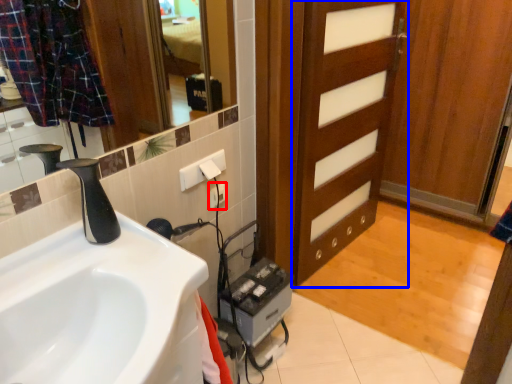
Question: Which object is closer to the camera taking this photo, electric outlet (highlighted by a red box) or door (highlighted by a blue box)?

Choices:
 (A) electric outlet
 (B) door

Answer: (B)